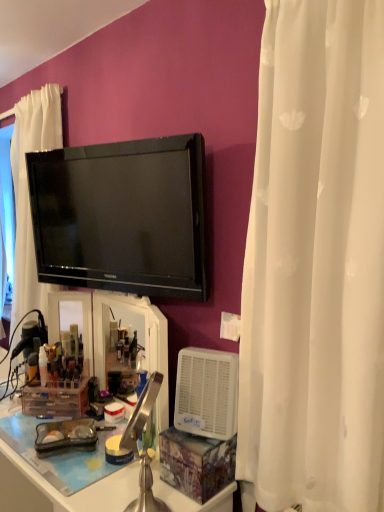
Question: Visually, is white plastic desk at lower left positioned to the left or to the right of translucent plastic container at lower left, which is the first toiletry from right to left?

Choices:
 (A) right
 (B) left

Answer: (A)

Question: From a real-world perspective, is white plastic desk at lower left physically located above or below translucent plastic container at lower left, which is the first toiletry from right to left?

Choices:
 (A) below
 (B) above

Answer: (A)

Question: Which object is the farthest from the translucent plastic container at lower left, which is counted as the second toiletry, starting from the left?

Choices:
 (A) white plastic air purifier at lower right
 (B) black glossy tv at upper center
 (C) white sheer curtain at right
 (D) white plastic desk at lower left
 (E) matte gold tube at left, the first toiletry viewed from the left

Answer: (C)

Question: Which of these objects is positioned closest to the white sheer curtain at right?

Choices:
 (A) black glossy tv at upper center
 (B) white plastic desk at lower left
 (C) white plastic air purifier at lower right
 (D) matte gold tube at left, positioned as the 2th toiletry in right-to-left order
 (E) translucent plastic container at lower left, which is counted as the second toiletry, starting from the left

Answer: (C)